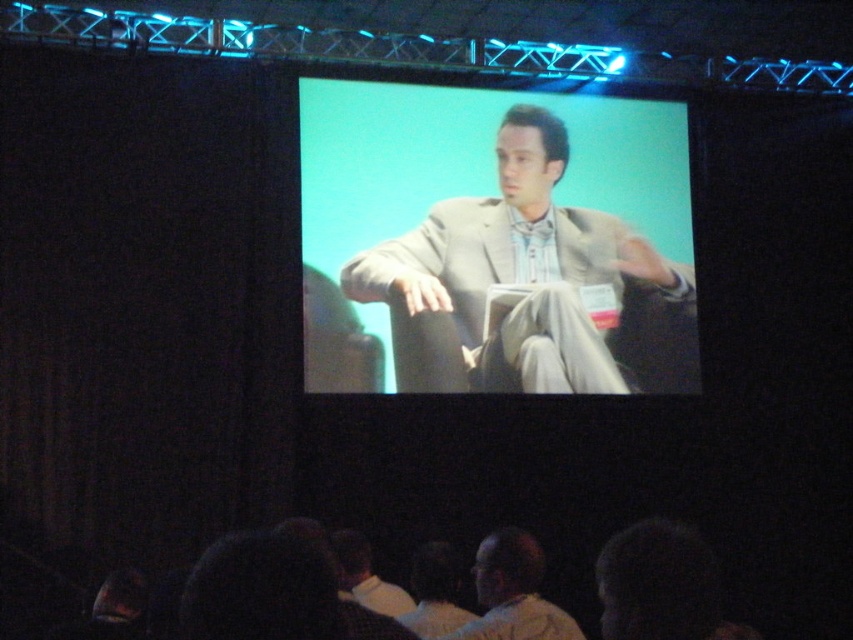
Question: Among these points, which one is nearest to the camera?

Choices:
 (A) (508, 552)
 (B) (347, 291)

Answer: (A)

Question: Which point appears closest to the camera in this image?

Choices:
 (A) (404, 250)
 (B) (496, 637)

Answer: (B)

Question: Among these points, which one is farthest from the camera?

Choices:
 (A) (634, 259)
 (B) (509, 564)

Answer: (A)

Question: Does light beige suit at center appear under light beige suit at lower center?

Choices:
 (A) yes
 (B) no

Answer: (B)

Question: Is light beige suit at center further to the viewer compared to light beige suit at lower center?

Choices:
 (A) yes
 (B) no

Answer: (A)

Question: Can you confirm if light beige suit at center is wider than light beige suit at lower center?

Choices:
 (A) no
 (B) yes

Answer: (B)